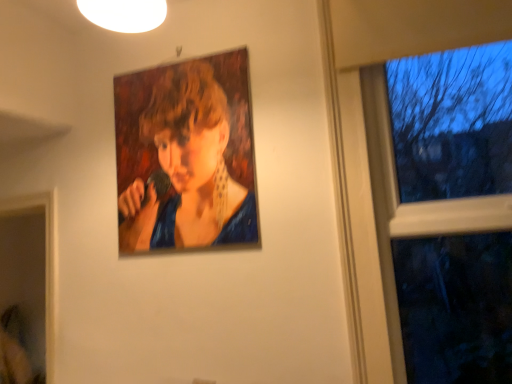
Question: From a real-world perspective, is transparent glass window at right on oil painting portrait at upper center?

Choices:
 (A) yes
 (B) no

Answer: (B)

Question: From the image's perspective, would you say transparent glass window at right is shown under oil painting portrait at upper center?

Choices:
 (A) no
 (B) yes

Answer: (B)

Question: Can you confirm if transparent glass window at right is shorter than oil painting portrait at upper center?

Choices:
 (A) yes
 (B) no

Answer: (B)

Question: From a real-world perspective, is transparent glass window at right beneath oil painting portrait at upper center?

Choices:
 (A) no
 (B) yes

Answer: (B)

Question: Is oil painting portrait at upper center inside transparent glass window at right?

Choices:
 (A) yes
 (B) no

Answer: (B)

Question: Is transparent glass window at right not inside oil painting portrait at upper center?

Choices:
 (A) yes
 (B) no

Answer: (A)

Question: Is oil painting portrait at upper center turned away from transparent glass window at right?

Choices:
 (A) yes
 (B) no

Answer: (B)

Question: Does oil painting portrait at upper center have a greater width compared to transparent glass window at right?

Choices:
 (A) no
 (B) yes

Answer: (A)

Question: Is oil painting portrait at upper center at the left side of transparent glass window at right?

Choices:
 (A) yes
 (B) no

Answer: (A)

Question: From the image's perspective, is oil painting portrait at upper center on transparent glass window at right?

Choices:
 (A) no
 (B) yes

Answer: (B)

Question: Is the position of oil painting portrait at upper center more distant than that of transparent glass window at right?

Choices:
 (A) no
 (B) yes

Answer: (B)

Question: Is oil painting portrait at upper center with transparent glass window at right?

Choices:
 (A) no
 (B) yes

Answer: (A)

Question: In terms of height, does oil painting portrait at upper center look taller or shorter compared to transparent glass window at right?

Choices:
 (A) tall
 (B) short

Answer: (B)